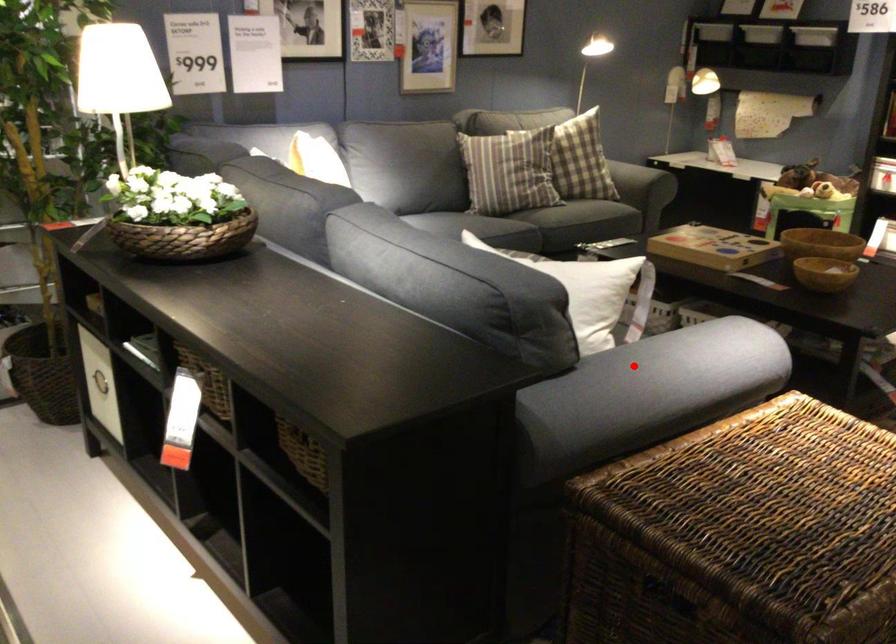
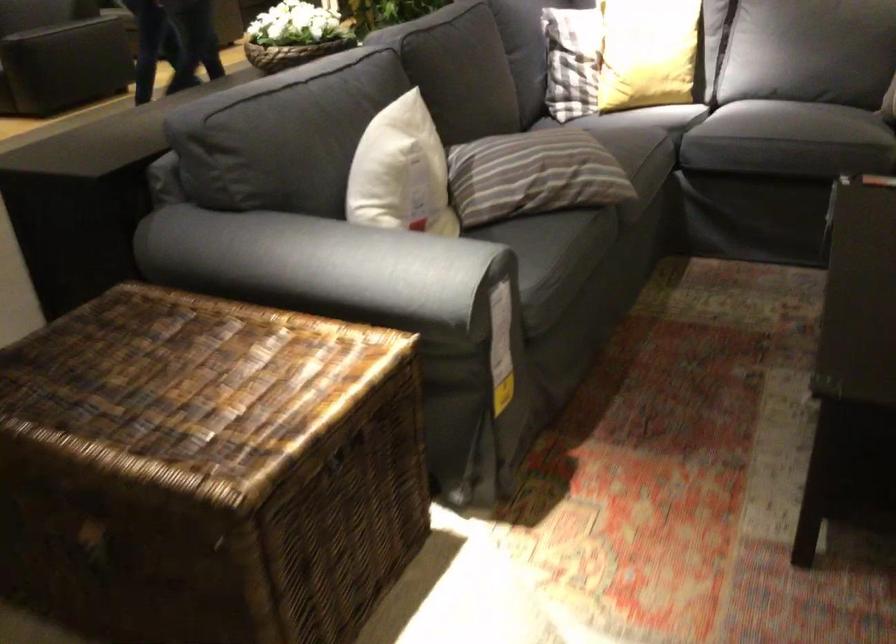
Locate, in the second image, the point that corresponds to the highlighted location in the first image.

(304, 265)